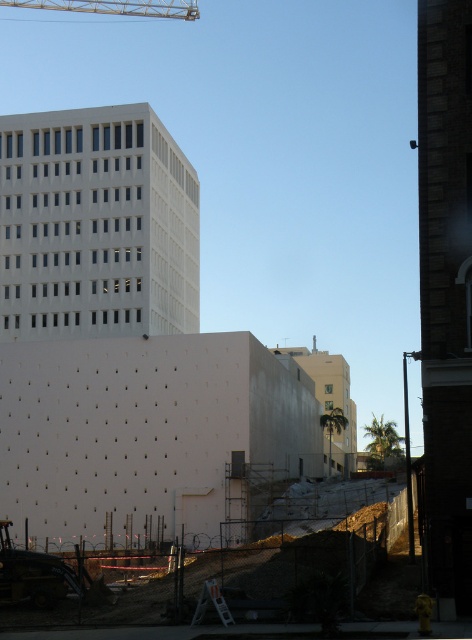
You are a construction worker who needs to determine if the white smooth building at upper left can be seen from the top of the yellow metallic crane at upper left. Based on their heights, can you see the building from there?

The white smooth building at upper left is shorter than the yellow metallic crane at upper left, so you can see the building from the top of the crane because it is taller than the building.

You are standing at the construction site and want to know how far the point at coordinates point [156,131] is from you. Can you determine the distance?

The point at coordinates point [156,131] is 123.60 meters away from you.

You are a construction worker standing at the site and need to move a heavy load from the white smooth building at upper left to the yellow metallic crane at upper left. Which object should you approach first to start the task?

You should start at the white smooth building at upper left because it is closer to you than the yellow metallic crane at upper left.